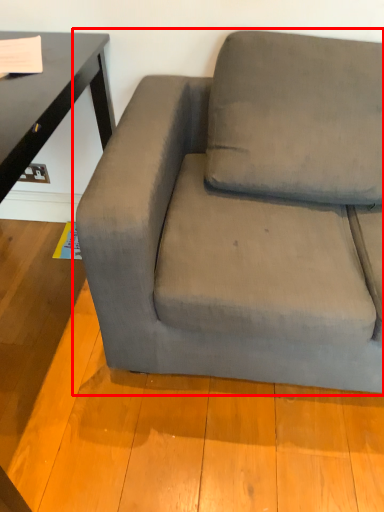
Question: From the image's perspective, where is studio couch (annotated by the red box) located relative to pillow?

Choices:
 (A) below
 (B) above

Answer: (A)